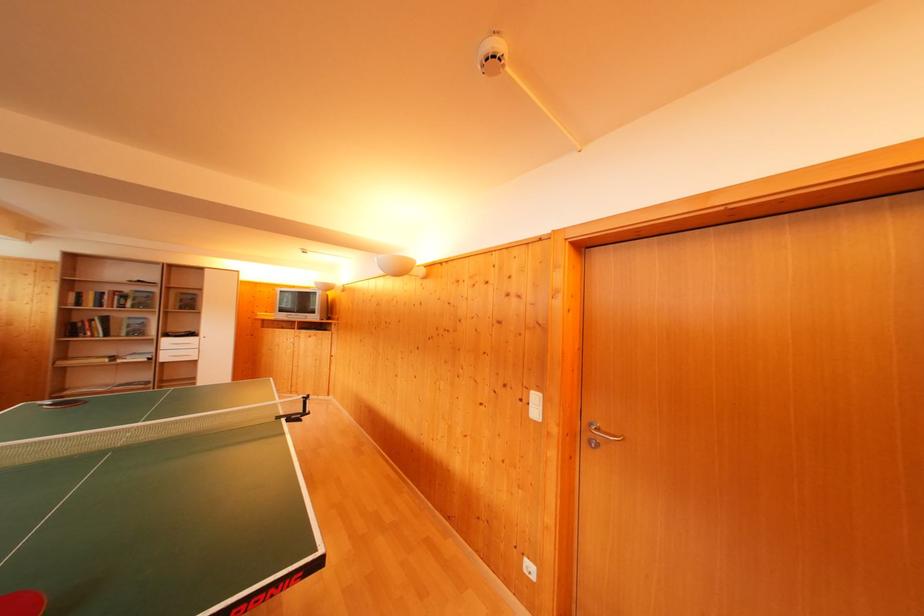
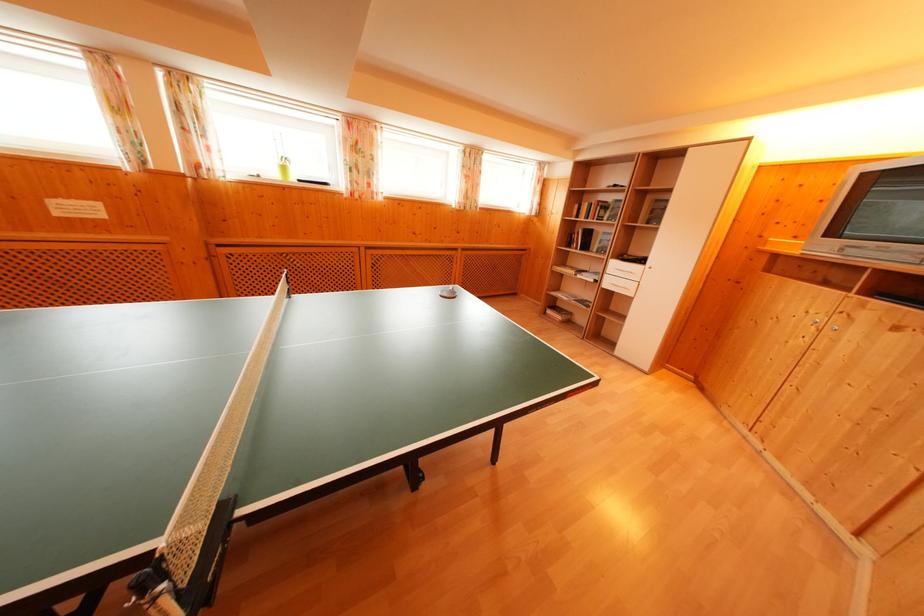
The point at (167, 352) is marked in the first image. Where is the corresponding point in the second image?

(614, 276)